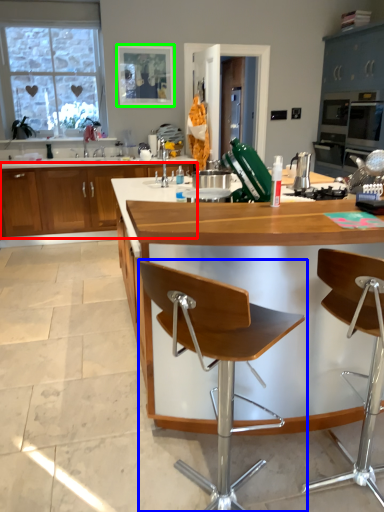
Question: Which object is positioned closest to cabinetry (highlighted by a red box)? Select from chair (highlighted by a blue box) and picture frame (highlighted by a green box).

Choices:
 (A) chair
 (B) picture frame

Answer: (B)